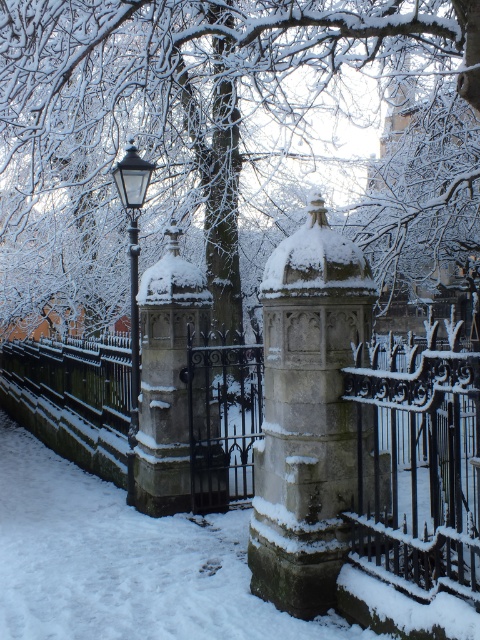
You are a photographer planning to take a winter landscape photo. You want to ensure the stone textured fence at center and the polished brass lamp post at upper left are both clearly visible. Based on their positions, which object will appear closer to the camera in the photo?

The stone textured fence at center will appear closer to the camera because it is in front of the polished brass lamp post at upper left.

You are planning to install a new garden feature and have both the stone textured fence at center and the polished brass lamp post at upper left in your design. If you want to place them side by side, which one should be placed first to ensure proper spacing?

The stone textured fence at center should be placed first because it has a larger size compared to the polished brass lamp post at upper left, ensuring there is enough space allocated for it.

You are standing at the base of the snow covered pillars in the winter scene. You see two points marked on the ground. The first point is at coordinate point (456,369) and the second is at point (135,356). Which point is closer to you?

Point (456,369) is in front of point (135,356), so it is closer to you.